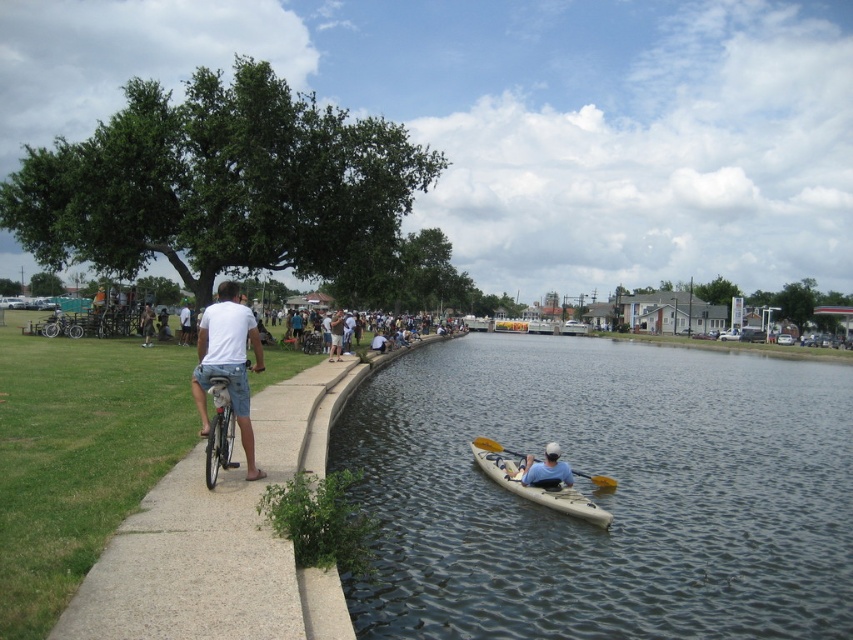
Question: Which object is closer to the camera taking this photo?

Choices:
 (A) gray concrete sidewalk at left
 (B) khaki shorts at left

Answer: (A)

Question: Which object is positioned farthest from the clear water at center?

Choices:
 (A) yellow plastic paddle at lower center
 (B) gray concrete sidewalk at left
 (C) khaki shorts at left

Answer: (C)

Question: Does yellow plastic paddle at lower center appear on the right side of khaki shorts at left?

Choices:
 (A) yes
 (B) no

Answer: (A)

Question: Is gray concrete sidewalk at left above khaki shorts at left?

Choices:
 (A) no
 (B) yes

Answer: (A)

Question: Does clear water at center have a greater width compared to blue fabric kayak at lower center?

Choices:
 (A) yes
 (B) no

Answer: (A)

Question: Which object is the closest to the gray concrete sidewalk at left?

Choices:
 (A) yellow plastic paddle at lower center
 (B) khaki shorts at left
 (C) clear water at center

Answer: (A)